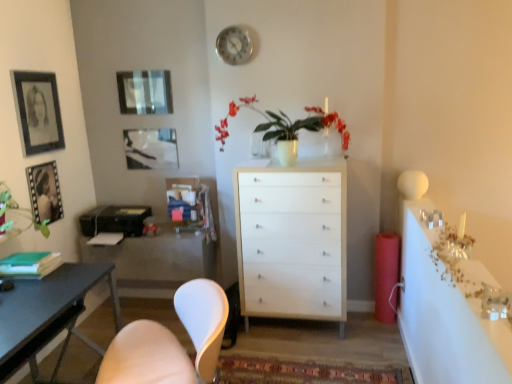
Question: Is metallic silver clock at upper center positioned before white glossy vase at center?

Choices:
 (A) no
 (B) yes

Answer: (A)

Question: Is metallic silver clock at upper center outside white glossy vase at center?

Choices:
 (A) no
 (B) yes

Answer: (B)

Question: Is white glossy vase at center at the back of metallic silver clock at upper center?

Choices:
 (A) yes
 (B) no

Answer: (B)

Question: Is metallic silver clock at upper center shorter than white glossy vase at center?

Choices:
 (A) yes
 (B) no

Answer: (A)

Question: Could you tell me if metallic silver clock at upper center is turned towards white glossy vase at center?

Choices:
 (A) no
 (B) yes

Answer: (A)

Question: Is point (507, 354) closer or farther from the camera than point (224, 49)?

Choices:
 (A) farther
 (B) closer

Answer: (B)

Question: Is white glossy countertop at right in front of or behind metallic silver clock at upper center in the image?

Choices:
 (A) front
 (B) behind

Answer: (A)

Question: From the image's perspective, relative to metallic silver clock at upper center, is white glossy countertop at right above or below?

Choices:
 (A) below
 (B) above

Answer: (A)

Question: Is white glossy countertop at right taller or shorter than metallic silver clock at upper center?

Choices:
 (A) short
 (B) tall

Answer: (A)

Question: From the image's perspective, is white glossy vase at center positioned above or below matte white cabinet at center?

Choices:
 (A) above
 (B) below

Answer: (A)

Question: Which is correct: white glossy vase at center is inside matte white cabinet at center, or outside of it?

Choices:
 (A) inside
 (B) outside

Answer: (B)

Question: Considering the positions of white glossy vase at center and matte white cabinet at center in the image, is white glossy vase at center taller or shorter than matte white cabinet at center?

Choices:
 (A) short
 (B) tall

Answer: (B)

Question: Considering the relative positions of white glossy vase at center and matte white cabinet at center in the image provided, is white glossy vase at center to the left or to the right of matte white cabinet at center?

Choices:
 (A) right
 (B) left

Answer: (A)

Question: From the image's perspective, relative to metallic silver clock at upper center, is white matte chair at lower left above or below?

Choices:
 (A) below
 (B) above

Answer: (A)

Question: Considering the positions of white matte chair at lower left and metallic silver clock at upper center in the image, is white matte chair at lower left taller or shorter than metallic silver clock at upper center?

Choices:
 (A) tall
 (B) short

Answer: (A)